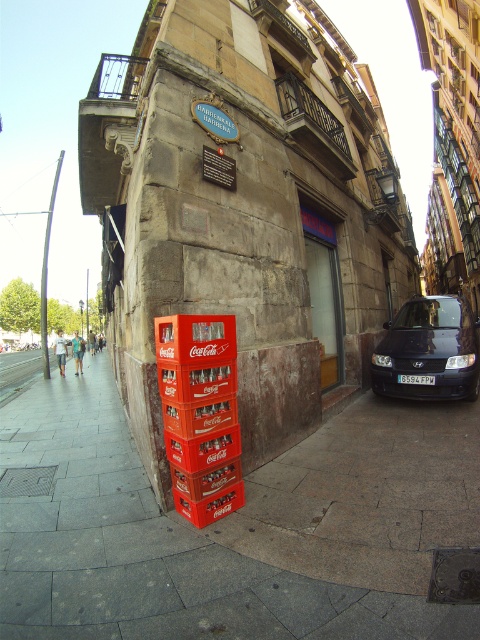
Does smooth concrete pavement at lower center have a lesser height compared to dark blue metallic car at right?

Yes, smooth concrete pavement at lower center is shorter than dark blue metallic car at right.

Which is in front, point (348, 525) or point (394, 364)?

Point (348, 525)

Which is in front, point (436, 547) or point (389, 369)?

Point (436, 547)

Find the location of a particular element. The image size is (480, 640). smooth concrete pavement at lower center is located at coordinates (236, 528).